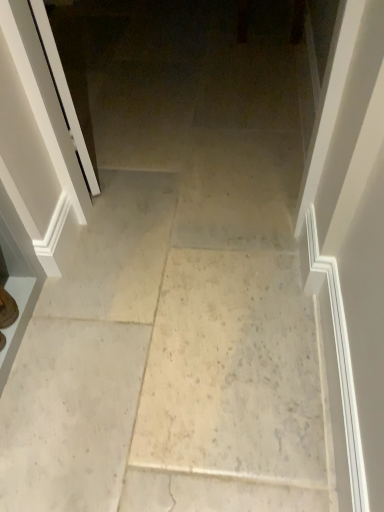
Question: Considering the positions of matte brown shoe at lower left and white marble floor at center in the image, is matte brown shoe at lower left wider or thinner than white marble floor at center?

Choices:
 (A) wide
 (B) thin

Answer: (B)

Question: Based on their sizes in the image, would you say matte brown shoe at lower left is bigger or smaller than white marble floor at center?

Choices:
 (A) big
 (B) small

Answer: (B)

Question: Estimate the real-world distances between objects in this image. Which object is farther from the white glossy screen door at left?

Choices:
 (A) matte brown shoe at lower left
 (B) white marble floor at center

Answer: (B)

Question: Which of these objects is positioned closest to the matte brown shoe at lower left?

Choices:
 (A) white marble floor at center
 (B) white glossy screen door at left

Answer: (B)